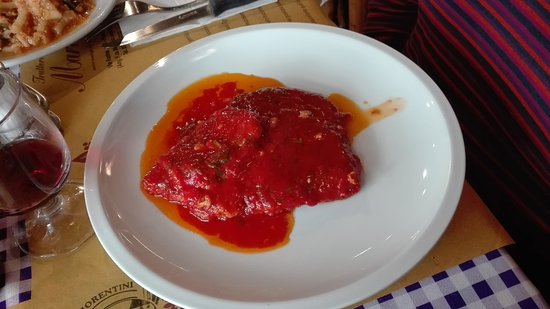
You are a GUI agent. You are given a task and a screenshot of the screen. Output one action in this format:
    pyautogui.click(x=<x>, y=<y>)
    Task: Click on the salt shaker
    
    Given the screenshot: What is the action you would take?
    pyautogui.click(x=5, y=93), pyautogui.click(x=16, y=117)